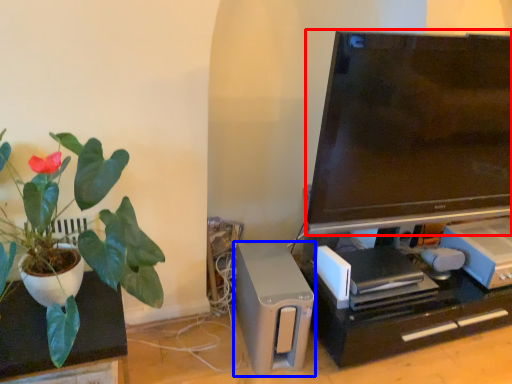
Question: Which of the following is the closest to the observer, television (highlighted by a red box) or appliance (highlighted by a blue box)?

Choices:
 (A) television
 (B) appliance

Answer: (A)